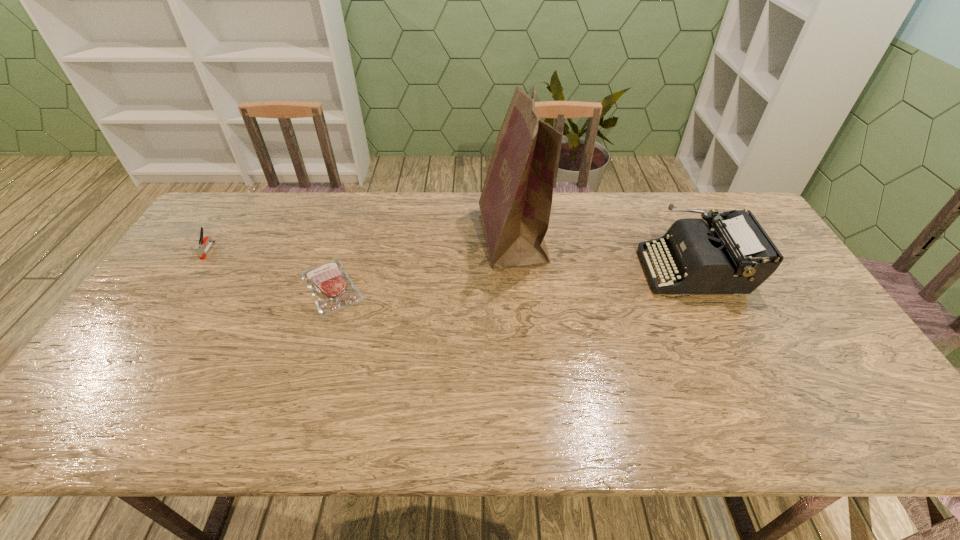
In the image, there is a desktop. Identify the location of free space at the near edge. (534, 409).

Image resolution: width=960 pixels, height=540 pixels. What are the coordinates of `free space at the left edge of the desktop` in the screenshot? It's located at (150, 299).

Where is `vacant space at the right edge of the desktop`? Image resolution: width=960 pixels, height=540 pixels. vacant space at the right edge of the desktop is located at coordinates (810, 379).

Locate an element on the screen. vacant region between the rightmost object and the stapler is located at coordinates (451, 260).

I want to click on free space between the second tallest object and the tallest object, so click(604, 253).

The image size is (960, 540). I want to click on free spot between the third tallest object and the grocery bag, so click(x=360, y=244).

What are the coordinates of `empty space between the typewriter and the steak` in the screenshot? It's located at (513, 278).

Locate an element on the screen. The height and width of the screenshot is (540, 960). free space between the rightmost object and the grocery bag is located at coordinates (604, 253).

You are a GUI agent. You are given a task and a screenshot of the screen. Output one action in this format:
    pyautogui.click(x=<x>, y=<y>)
    Task: Click on the free space between the tallest object and the second object from left to right
    
    Given the screenshot: What is the action you would take?
    pyautogui.click(x=421, y=261)

Identify the location of vacant area between the third tallest object and the shortest object. (270, 268).